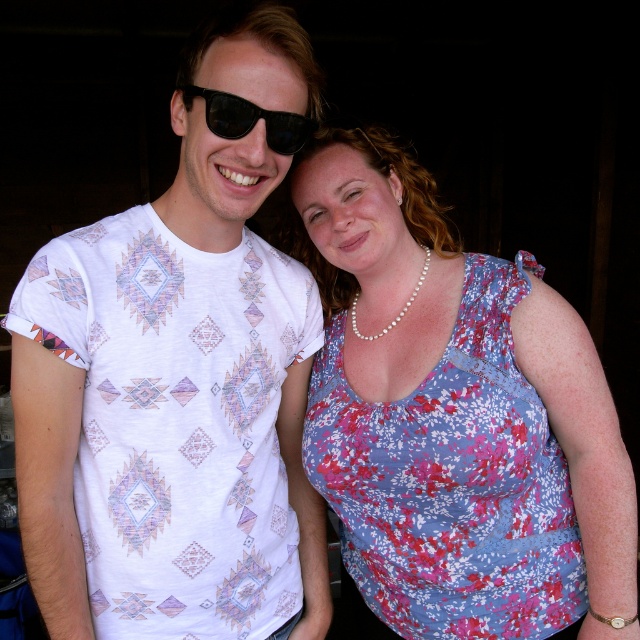
You are a photographer trying to adjust the lighting for a photo shoot. You notice the floral print fabric dress at right and the black reflective sunglasses at upper center. Which object is located to the right of the other?

The floral print fabric dress at right is positioned on the right side of black reflective sunglasses at upper center.